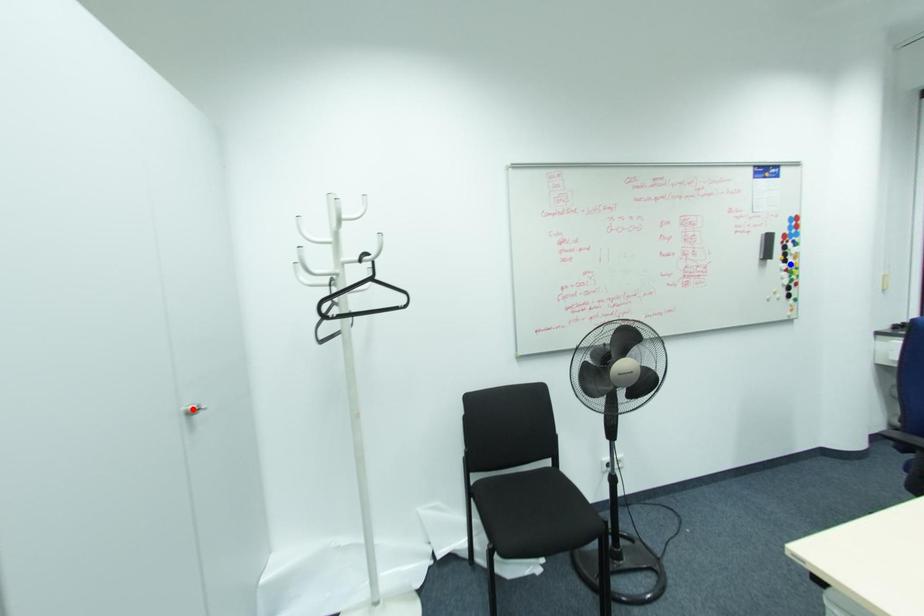
Question: Which of the two points in the image is closer to the camera?

Choices:
 (A) Blue point is closer.
 (B) Red point is closer.

Answer: (B)